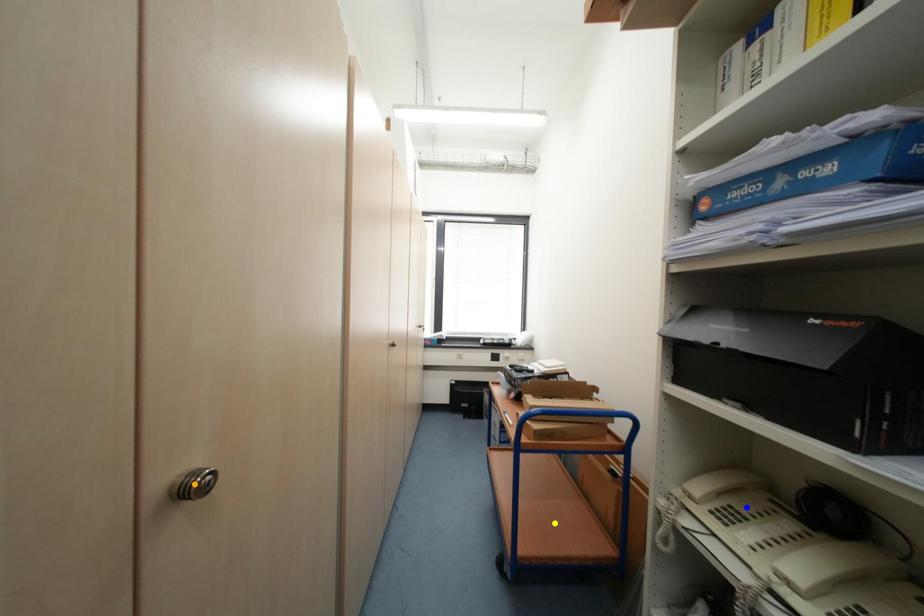
Order these from nearest to farthest:
1. blue point
2. yellow point
3. orange point

orange point → blue point → yellow point